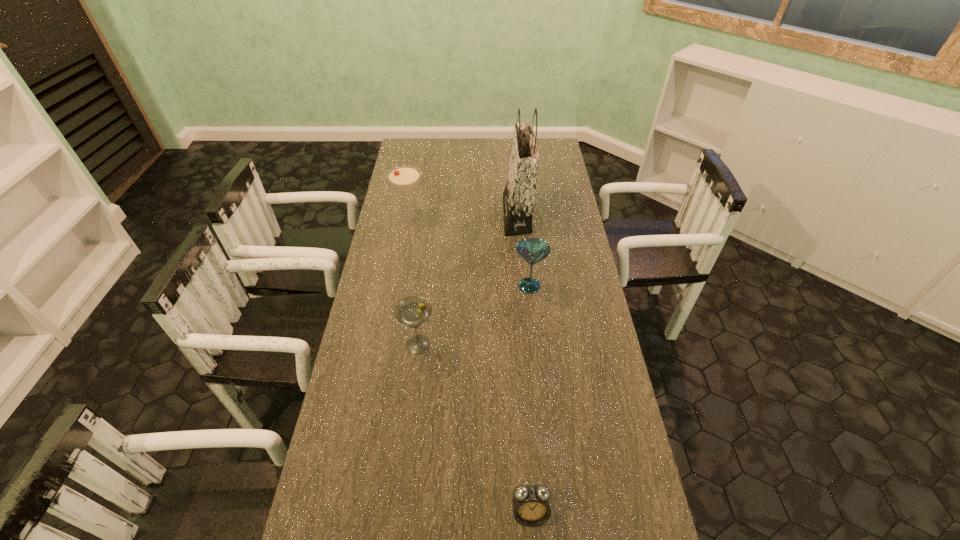
The image size is (960, 540). Identify the location of vacant region that satisfies the following two spatial constraints: 1. on the front side of the second nearest object; 2. on the right side of the farthest martini. (388, 345).

In order to click on blank space that satisfies the following two spatial constraints: 1. on the front of the tallest object with the design; 2. on the front side of the farthest martini in this screenshot , I will do `click(517, 218)`.

At what (x,y) coordinates should I click in order to perform the action: click on vacant region that satisfies the following two spatial constraints: 1. on the front of the second nearest martini with the design; 2. on the right side of the shopping bag. Please return your answer as a coordinate pair (x, y). The height and width of the screenshot is (540, 960). Looking at the image, I should click on (523, 286).